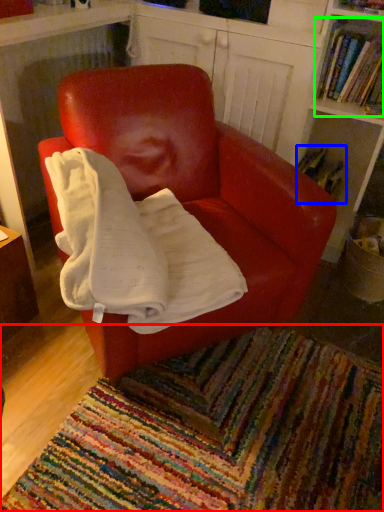
Question: Considering the real-world distances, which object is farthest from mat (highlighted by a red box)? book (highlighted by a blue box) or book (highlighted by a green box)?

Choices:
 (A) book
 (B) book

Answer: (B)